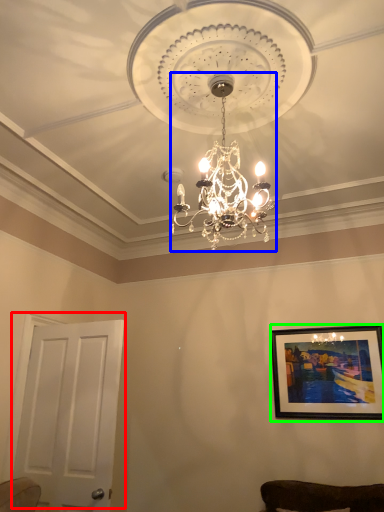
Question: Based on their relative distances, which object is nearer to door (highlighted by a red box)? Choose from lamp (highlighted by a blue box) and picture frame (highlighted by a green box).

Choices:
 (A) lamp
 (B) picture frame

Answer: (A)